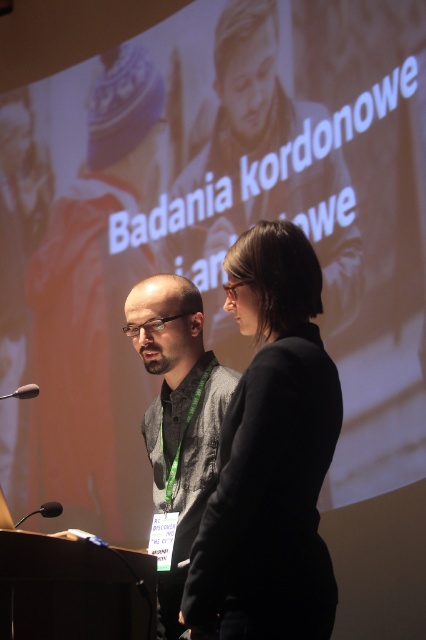
What do you see at coordinates (45, 509) in the screenshot? Image resolution: width=426 pixels, height=640 pixels. I see `black matte microphone at lower left` at bounding box center [45, 509].

Does point (45, 515) come behind point (37, 385)?

No, (45, 515) is closer to viewer.

Find the location of `black matte microphone at lower left`. black matte microphone at lower left is located at coordinates (45, 509).

Looking at this image, does black fabric jacket at center have a greater width compared to black matte microphone at lower left?

In fact, black fabric jacket at center might be narrower than black matte microphone at lower left.

Is point (227, 464) positioned before point (51, 506)?

Yes, point (227, 464) is in front of point (51, 506).

Who is more distant from viewer, [316,572] or [23,518]?

Point [23,518]

Where is `black fabric jacket at center`? black fabric jacket at center is located at coordinates (270, 456).

Who is shorter, dark gray textured shirt at center or matte black microphone at lower left?

matte black microphone at lower left is shorter.

Does dark gray textured shirt at center come behind matte black microphone at lower left?

That is False.

Which is in front, point (161, 604) or point (36, 388)?

Point (161, 604) is in front.

Image resolution: width=426 pixels, height=640 pixels. I want to click on dark gray textured shirt at center, so click(178, 417).